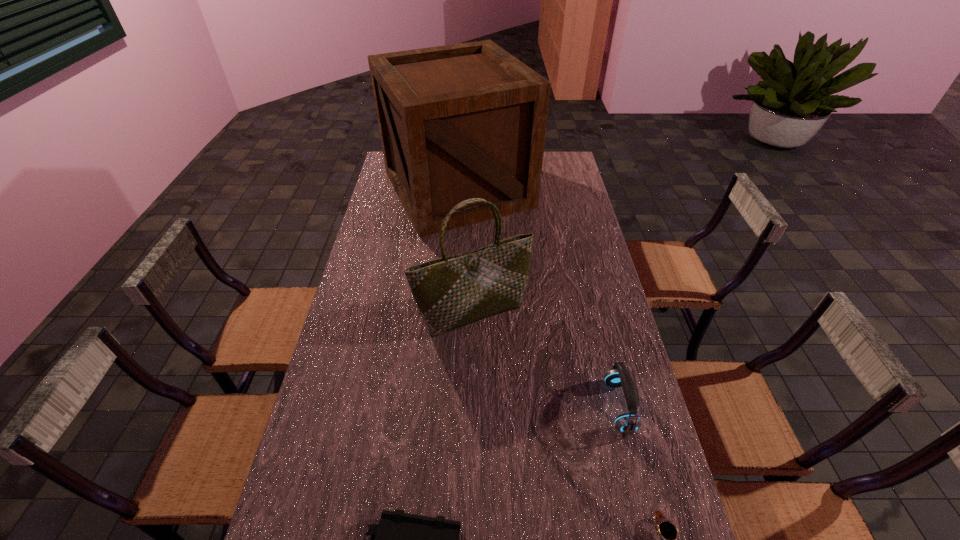
Locate an element on the screen. The height and width of the screenshot is (540, 960). free spot between the box and the third nearest object is located at coordinates (539, 298).

Find the location of `the second closest object relative to the third shortest object`. the second closest object relative to the third shortest object is located at coordinates (450, 292).

Locate an element on the screen. This screenshot has width=960, height=540. object that is the second closest to the fourth nearest object is located at coordinates (462, 121).

Image resolution: width=960 pixels, height=540 pixels. In order to click on vacant space that satisfies the following two spatial constraints: 1. on the front side of the second farthest object; 2. on the left side of the farthest object in this screenshot , I will do `click(450, 313)`.